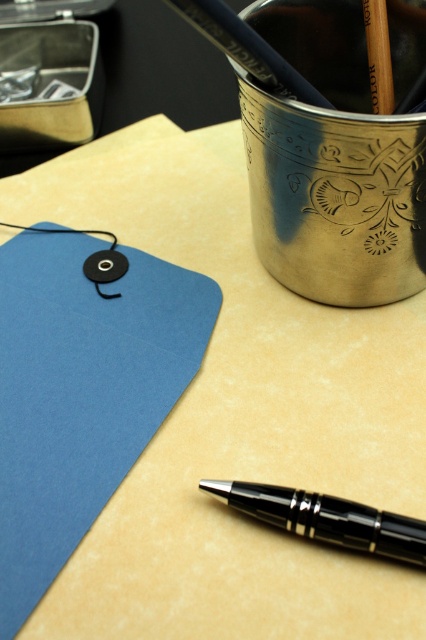
You are looking at the workspace and want to place a small sticker between the two points labeled as point (71,307) and point (311,504). Based on their positions, which point is closer to you?

Point (311,504) is closer to you because point (71,307) is behind it.

Looking at this image, you are organizing your desk and need to access the black polished pen at lower right. Is the matte blue paper at upper left blocking your direct access to it?

The matte blue paper at upper left is positioned over the black polished pen at lower right, so yes, the paper is blocking direct access to the pen.